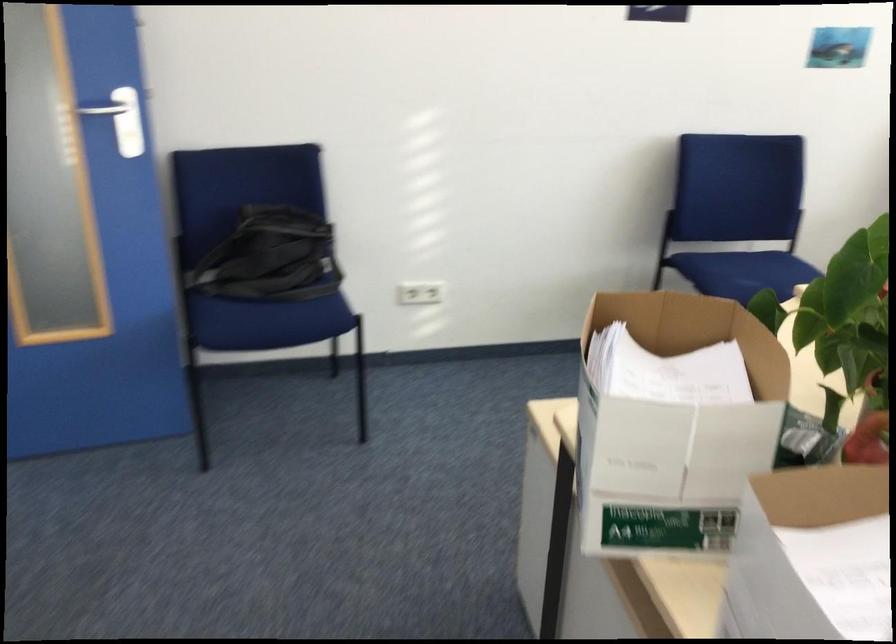
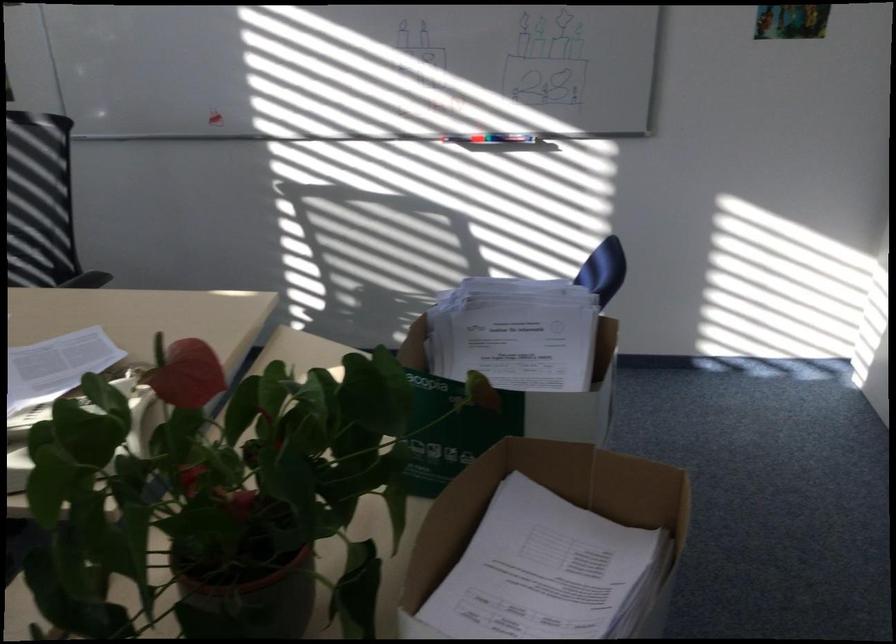
Find the pixel in the second image that matches pixel 625 471 in the first image.

(550, 515)